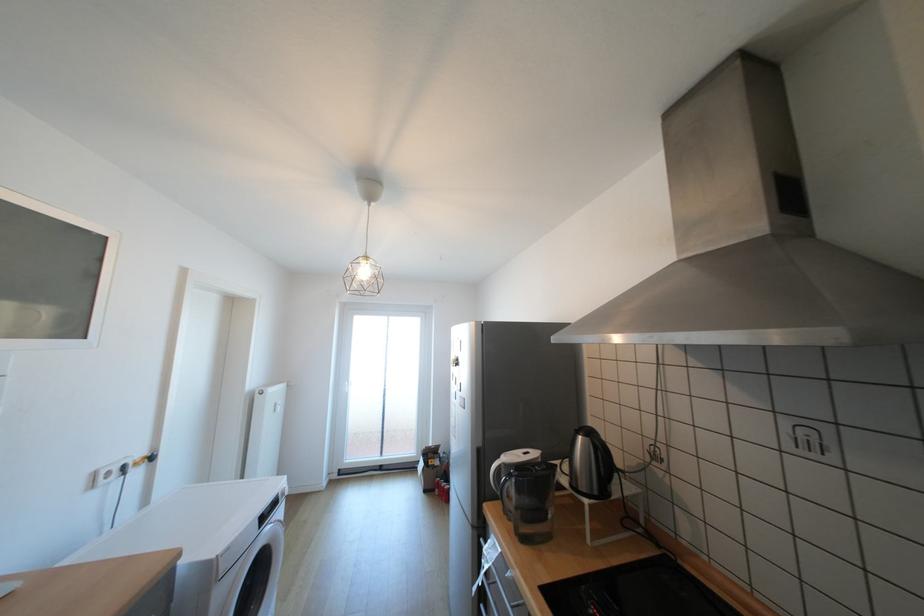
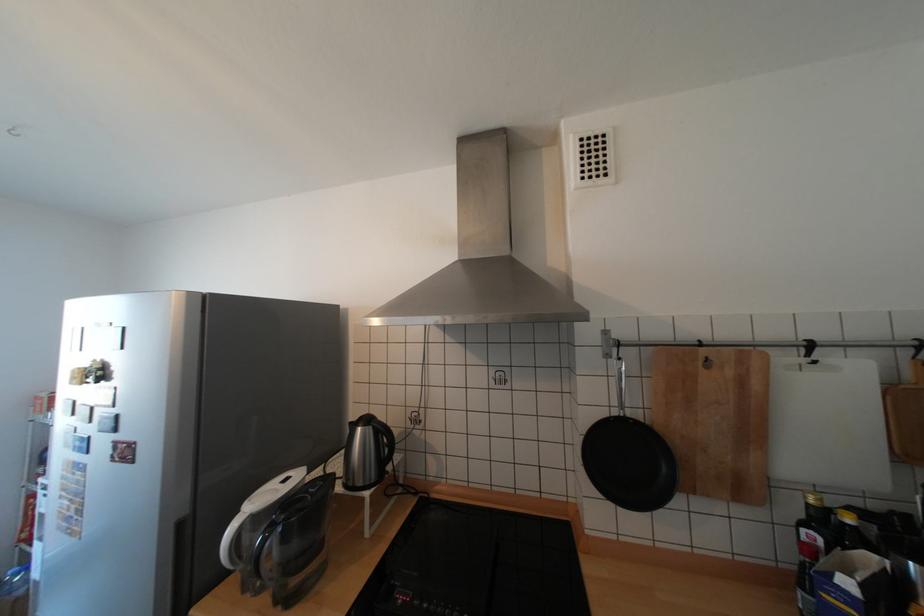
Find the pixel in the second image that matches pixel 611 469 in the first image.

(392, 453)